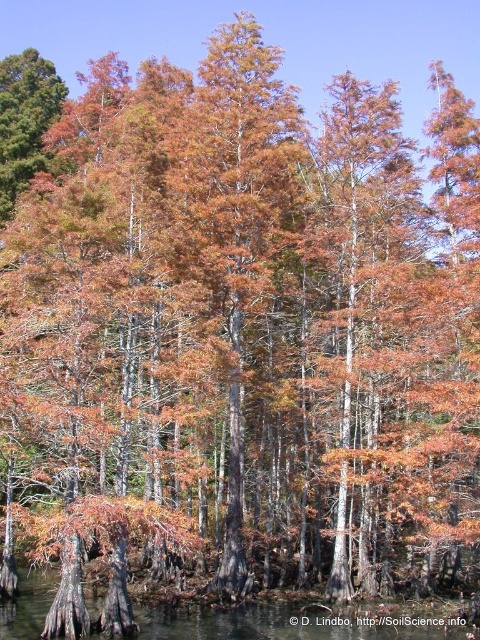
You are standing in the grove of cypress trees and see two points marked in the image. Which point is closer to you, point (210,156) or point (159,628)?

Point (210,156) is closer to you than point (159,628) because it is further to the viewer.